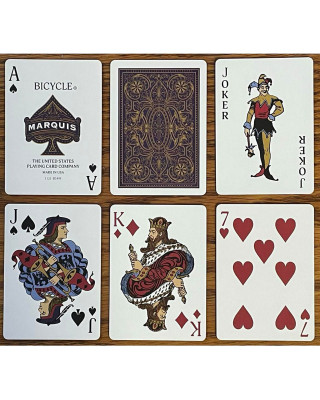
You are a GUI agent. You are given a task and a screenshot of the screen. Output one action in this format:
    pyautogui.click(x=<x>, y=<y>)
    Task: Click on the playing cards
    
    Given the screenshot: What is the action you would take?
    pyautogui.click(x=92, y=219), pyautogui.click(x=83, y=183), pyautogui.click(x=145, y=181), pyautogui.click(x=147, y=214), pyautogui.click(x=295, y=310), pyautogui.click(x=288, y=154)